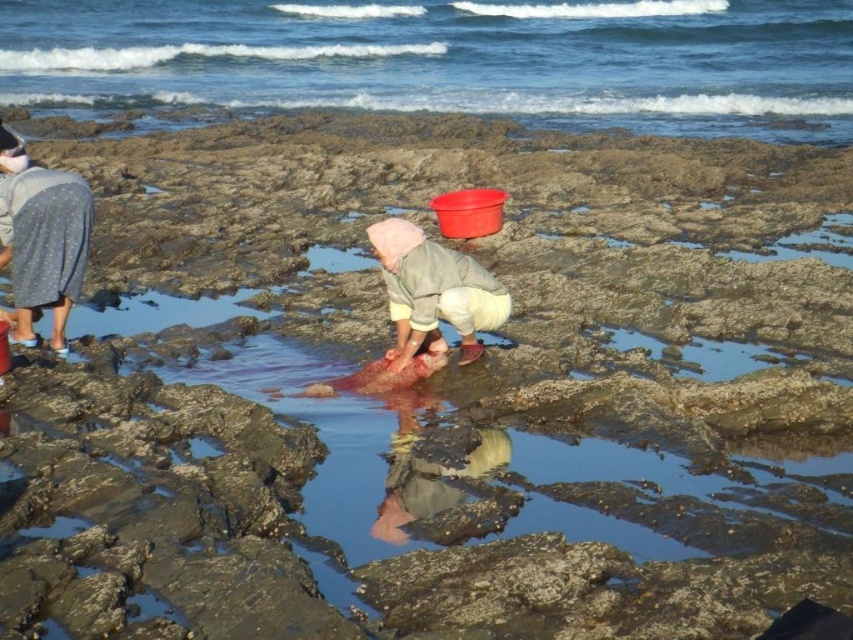
Between point (132, 77) and point (415, 342), which one is positioned behind?

The point (132, 77) is behind.

How far apart are blue water at upper center and pink fabric at center?

24.09 meters

Who is more distant from viewer, (x=654, y=45) or (x=373, y=244)?

The point (x=654, y=45) is behind.

The image size is (853, 640). I want to click on blue water at upper center, so click(x=450, y=60).

Who is lower down, gray dotted skirt at upper left or pink fabric at center?

pink fabric at center

Which is more to the right, gray dotted skirt at upper left or pink fabric at center?

Positioned to the right is pink fabric at center.

Based on the photo, who is more distant from viewer, (x=22, y=241) or (x=427, y=324)?

Positioned behind is point (x=22, y=241).

Locate an element on the screen. The height and width of the screenshot is (640, 853). gray dotted skirt at upper left is located at coordinates (44, 244).

Who is more forward, (747,76) or (21,333)?

Point (21,333)

Image resolution: width=853 pixels, height=640 pixels. I want to click on blue water at upper center, so click(450, 60).